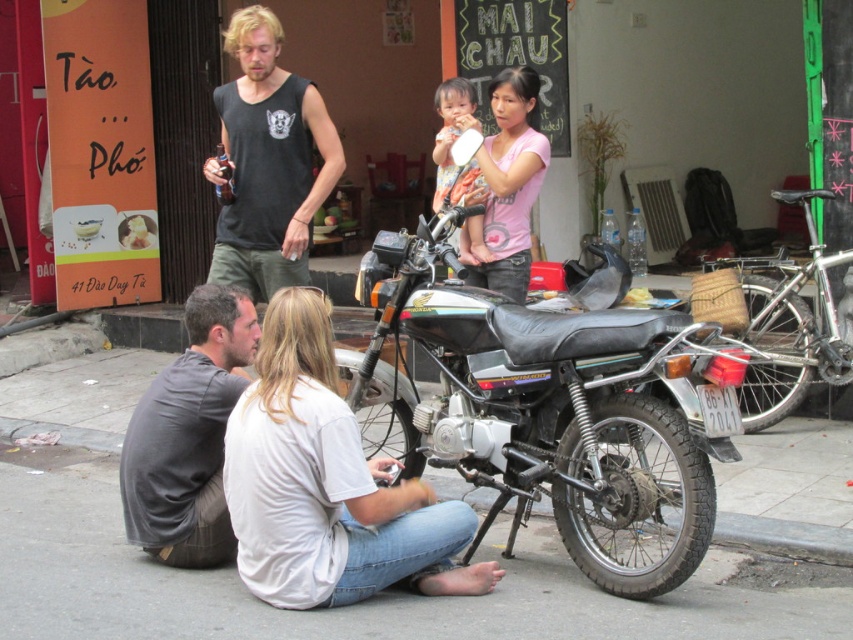
Between white matte shirt at lower center and silver metallic motorcycle at center, which one has less height?

Standing shorter between the two is white matte shirt at lower center.

Which is below, white matte shirt at lower center or silver metallic motorcycle at center?

Positioned lower is white matte shirt at lower center.

Is point (339, 552) closer to viewer compared to point (810, 273)?

Yes, point (339, 552) is closer to viewer.

The height and width of the screenshot is (640, 853). I want to click on white matte shirt at lower center, so click(328, 483).

Does pink matte shirt at upper center have a lesser height compared to smooth plastic cup at center?

No.

Can you confirm if pink matte shirt at upper center is thinner than smooth plastic cup at center?

No, pink matte shirt at upper center is not thinner than smooth plastic cup at center.

This screenshot has height=640, width=853. In order to click on pink matte shirt at upper center in this screenshot , I will do `click(509, 182)`.

Locate an element on the screen. Image resolution: width=853 pixels, height=640 pixels. pink matte shirt at upper center is located at coordinates (509, 182).

Consider the image. Does white matte shirt at lower center have a larger size compared to gray cotton shirt at lower left?

Yes, white matte shirt at lower center is bigger than gray cotton shirt at lower left.

Between point (332, 369) and point (202, 365), which one is positioned behind?

The point (202, 365) is more distant.

Which is in front, point (308, 314) or point (230, 394)?

Point (308, 314) is more forward.

Locate an element on the screen. white matte shirt at lower center is located at coordinates (328, 483).